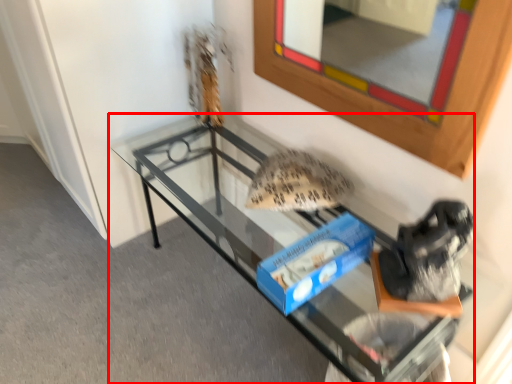
Question: From the image's perspective, what is the correct spatial positioning of furniture (annotated by the red box) in reference to mirror?

Choices:
 (A) above
 (B) below

Answer: (B)